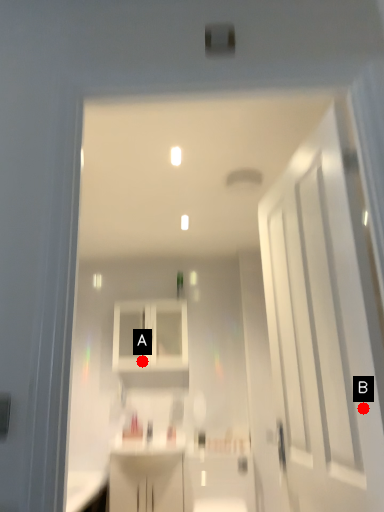
Question: Two points are circled on the image, labeled by A and B beside each circle. Which point is closer to the camera?

Choices:
 (A) A is closer
 (B) B is closer

Answer: (B)